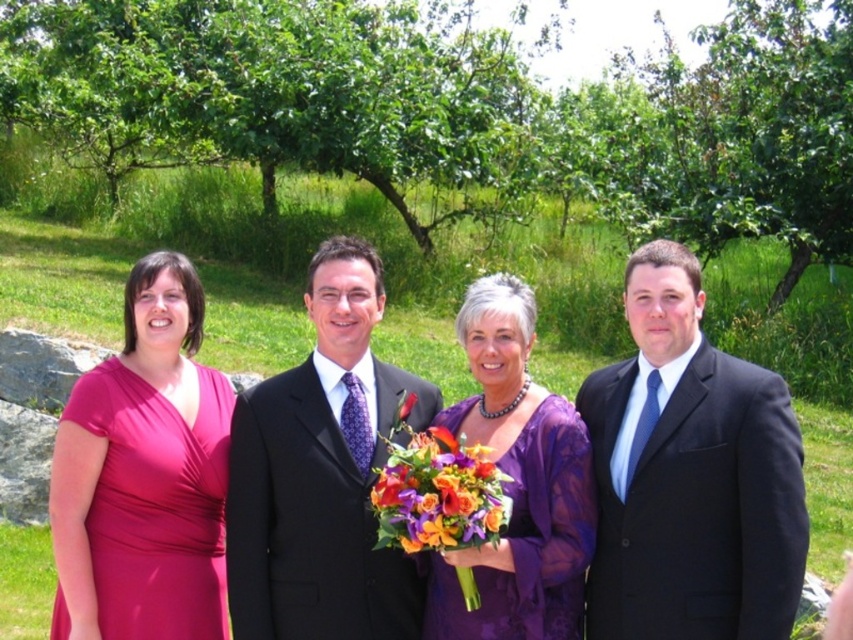
Can you confirm if matte purple dress at center is positioned above matte black suit at center?

Incorrect, matte purple dress at center is not positioned above matte black suit at center.

Can you confirm if matte purple dress at center is thinner than matte black suit at center?

No, matte purple dress at center is not thinner than matte black suit at center.

Identify the location of matte purple dress at center. Image resolution: width=853 pixels, height=640 pixels. (421, 552).

Between matte pink dress at left and vibrant silk bouquet at center, which one appears on the right side from the viewer's perspective?

From the viewer's perspective, vibrant silk bouquet at center appears more on the right side.

Does matte pink dress at left appear on the right side of vibrant silk bouquet at center?

In fact, matte pink dress at left is to the left of vibrant silk bouquet at center.

Which is in front, point (57, 486) or point (479, 499)?

Point (479, 499) is in front.

You are a GUI agent. You are given a task and a screenshot of the screen. Output one action in this format:
    pyautogui.click(x=<x>, y=<y>)
    Task: Click on the matte pink dress at left
    
    Given the screenshot: What is the action you would take?
    pyautogui.click(x=144, y=476)

Is matte black suit at right bigger than purple lace dress at center?

Yes, matte black suit at right is bigger than purple lace dress at center.

Who is shorter, matte black suit at right or purple lace dress at center?

Standing shorter between the two is purple lace dress at center.

The height and width of the screenshot is (640, 853). Identify the location of matte black suit at right. (689, 476).

This screenshot has width=853, height=640. I want to click on matte black suit at right, so click(689, 476).